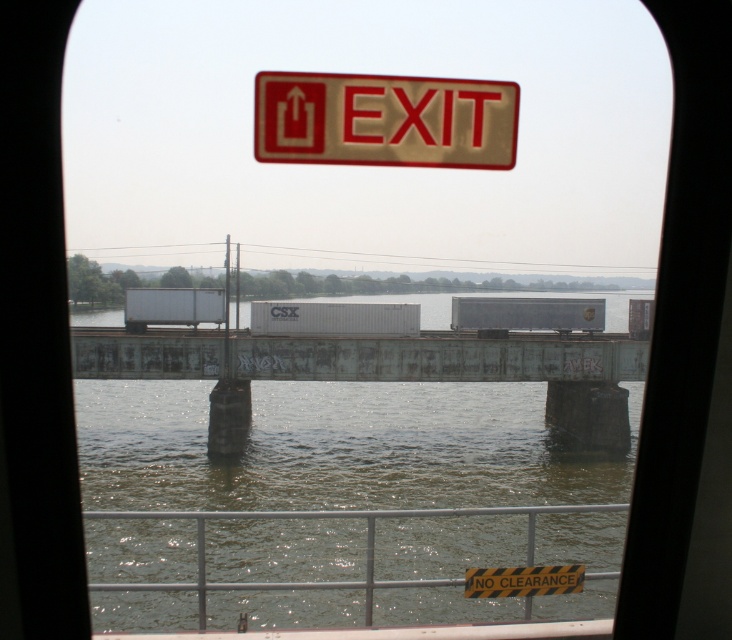
You are seated in the vehicle and want to know which of the two points, point (x=376, y=362) or point (x=509, y=161), is closer to you. Based on the image, which point is nearer?

Point (x=376, y=362) is further to the viewer than point (x=509, y=161), so the closer point is point (x=509, y=161).

You are a passenger on a ferry and need to locate the emergency exit. You see the rusty metal bridge at center and the gold textured exit sign at upper center. Which object is bigger in size?

The rusty metal bridge at center has a larger size compared to the gold textured exit sign at upper center.

You are a passenger on a ferry and want to locate the emergency exit. You see the rusty metal bridge at center and the gold textured exit sign at upper center. Based on their positions, which object is closer to the left side of the window frame?

The rusty metal bridge at center is positioned on the left side of the gold textured exit sign at upper center, meaning it is closer to the left side of the window frame.